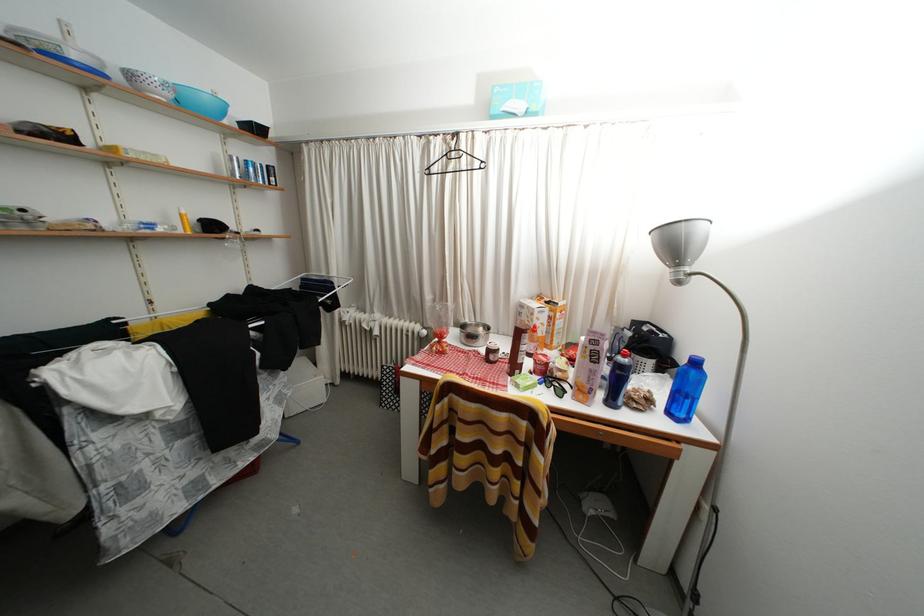
What do you see at coordinates (681, 246) in the screenshot?
I see `a grey lamp head` at bounding box center [681, 246].